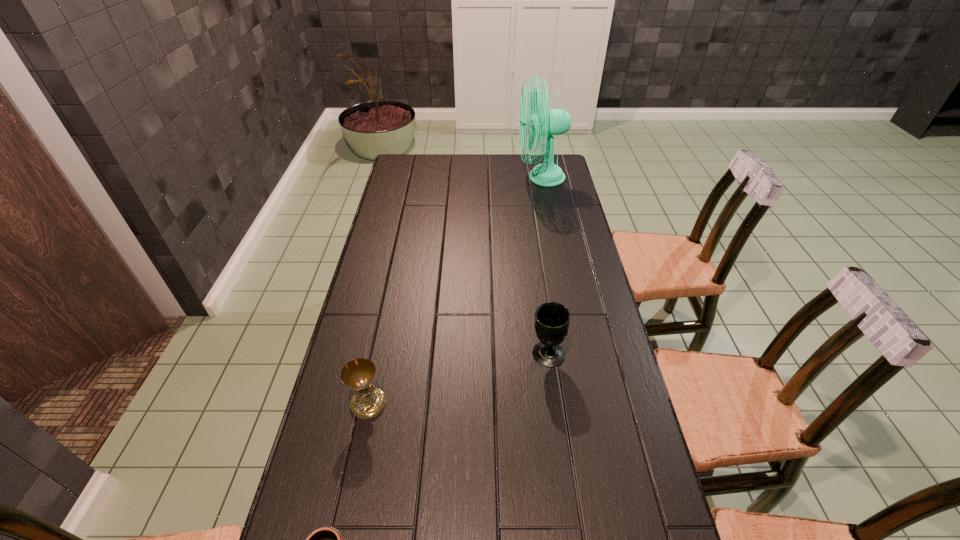
The image size is (960, 540). I want to click on unoccupied position between the fan and the right chalice, so click(x=544, y=266).

Identify the location of unoccupied area between the tallest object and the taller chalice. The height and width of the screenshot is (540, 960). (544, 266).

Find the location of a particular element. This screenshot has width=960, height=540. empty space that is in between the fan and the third nearest object is located at coordinates (544, 266).

Find the location of a particular element. The height and width of the screenshot is (540, 960). free space between the right chalice and the shorter chalice is located at coordinates (458, 379).

Locate an element on the screen. The image size is (960, 540). unoccupied position between the farther chalice and the left chalice is located at coordinates (458, 379).

What are the coordinates of `free space between the taller chalice and the nearer chalice` in the screenshot? It's located at (458, 379).

Locate an element on the screen. Image resolution: width=960 pixels, height=540 pixels. object that stands as the second closest to the tallest object is located at coordinates (368, 401).

This screenshot has width=960, height=540. Identify the location of object that is the third nearest to the mug. (549, 122).

You are a GUI agent. You are given a task and a screenshot of the screen. Output one action in this format:
    pyautogui.click(x=<x>, y=<y>)
    Task: Click on the vacant space that satisfies the following two spatial constraints: 1. on the back side of the right chalice; 2. on the left side of the second shortest object
    The height and width of the screenshot is (540, 960).
    Given the screenshot: What is the action you would take?
    tap(379, 354)

The height and width of the screenshot is (540, 960). I want to click on free space that satisfies the following two spatial constraints: 1. in front of the fan to blow air; 2. on the front side of the shorter chalice, so (586, 403).